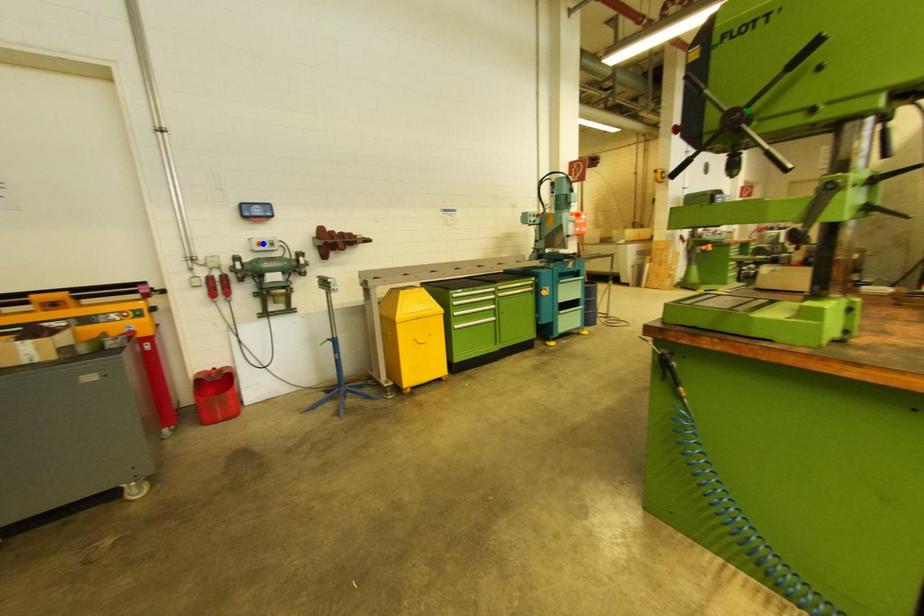
Order these from nearest to farthest:
A) green point
B) orange point
C) blue point

green point
blue point
orange point